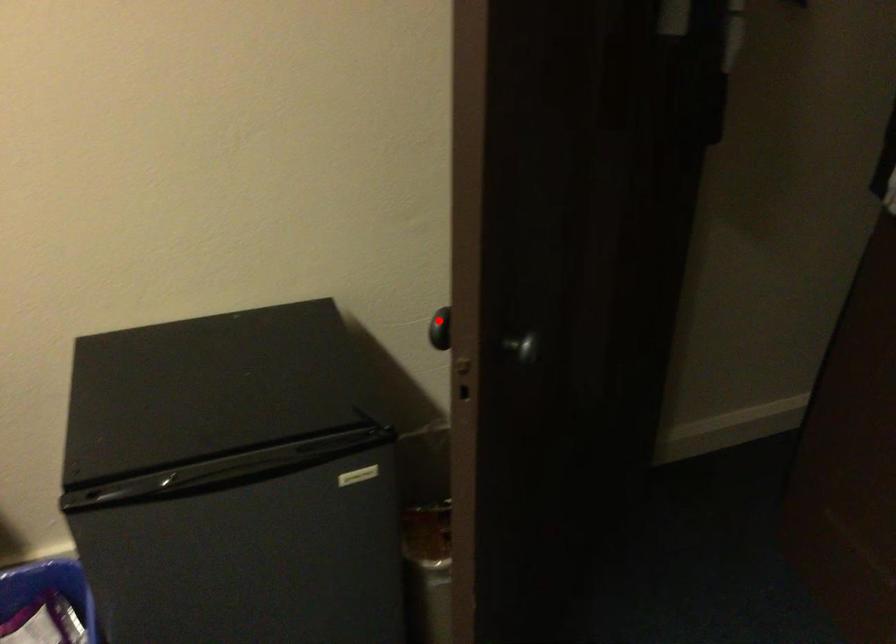
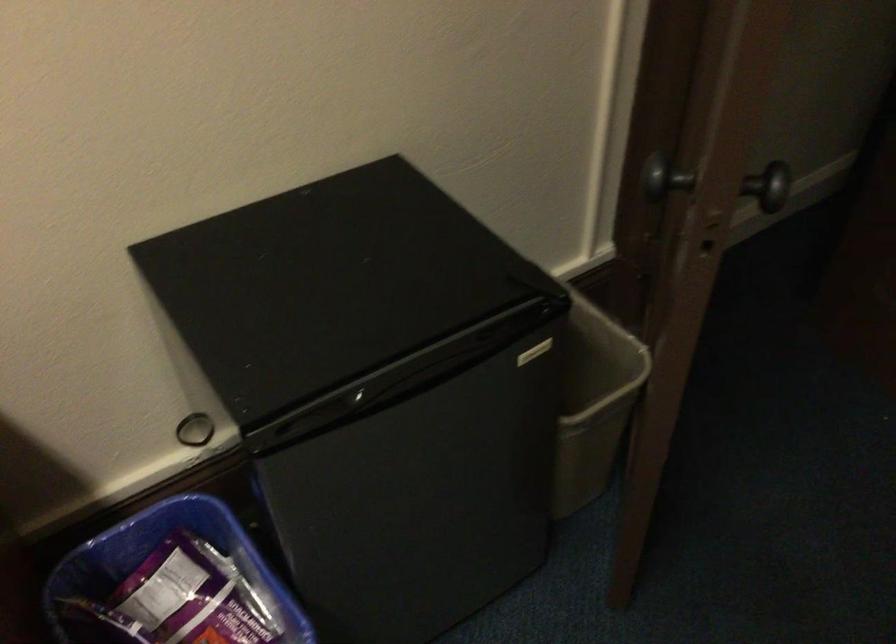
Question: I am providing you with two images of the same scene from different viewpoints. In image1, a red point is highlighted. Considering the same 3D point in image2, which of the following is correct?

Choices:
 (A) It is closer
 (B) It is farther

Answer: (A)